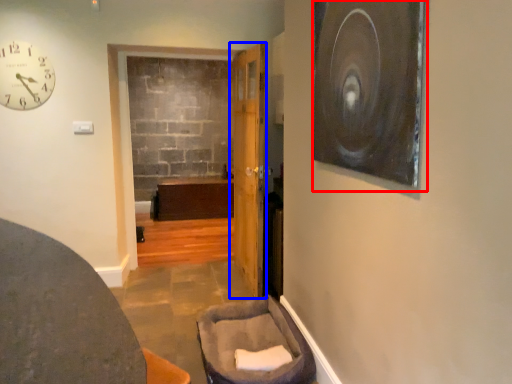
Question: Which of the following is the closest to the observer, picture frame (highlighted by a red box) or door (highlighted by a blue box)?

Choices:
 (A) picture frame
 (B) door

Answer: (A)